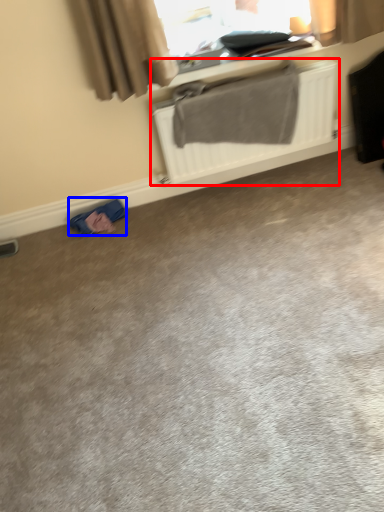
Question: Among these objects, which one is nearest to the camera, radiator (highlighted by a red box) or material (highlighted by a blue box)?

Choices:
 (A) radiator
 (B) material

Answer: (A)